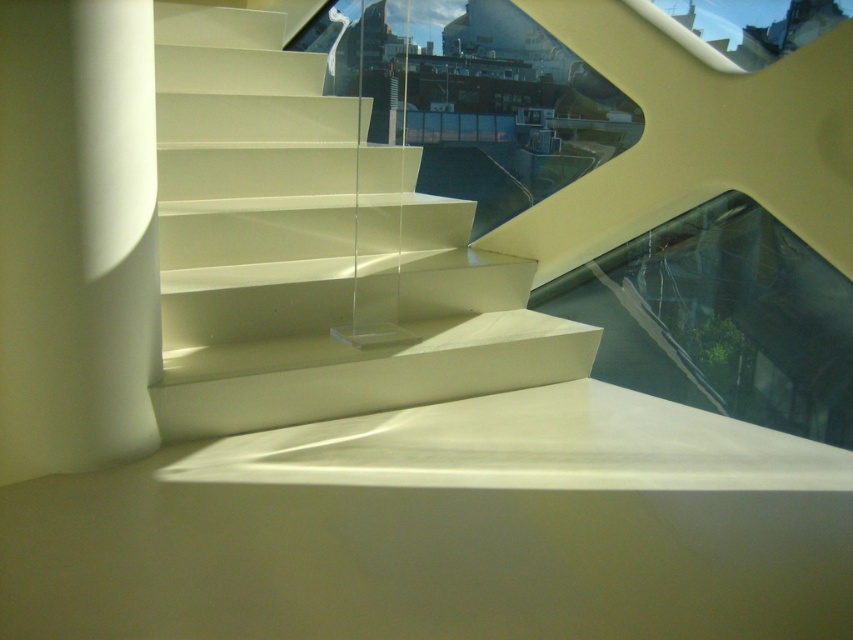
You are an interior designer planning to place a 1.2 meter wide sofa in this space. You have two options for placement near the white glossy stairs at center and the white matte pillar at left. Which location would allow the sofa to fit better without overlapping either object?

The white glossy stairs at center is wider than the white matte pillar at left, so placing the sofa near the white glossy stairs at center would provide more space for the sofa to fit without overlapping.

You are standing at the bottom of the staircase and want to walk towards the curved glass window to the right. There are two points marked on the floor, point A at coordinates point A is point (x=268, y=170) and point B is point (x=47, y=352). Which point should you step on first to ensure you are moving towards the window?

You should step on point B first because point A is behind point B, meaning point B is closer to your starting position at the bottom of the staircase.

You are an architect designing a new building. You need to ensure that the white glossy stairs at center do not block the view from the upper floor to the white matte pillar at left. Based on the scene description, is this possible?

The white glossy stairs at center is positioned over the white matte pillar at left, so the stairs are directly above the pillar. This means that from the upper floor, the view to the white matte pillar at left would be blocked by the stairs.